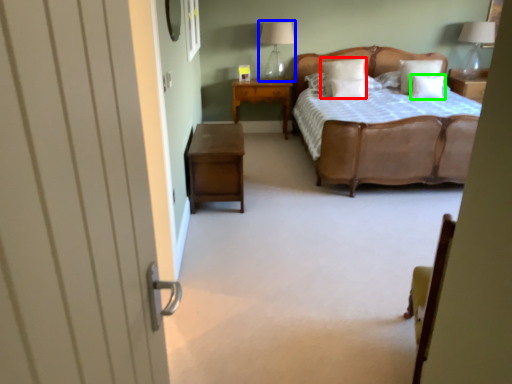
Question: Considering the real-world distances, which object is closest to pillow (highlighted by a red box)? table lamp (highlighted by a blue box) or pillow (highlighted by a green box).

Choices:
 (A) table lamp
 (B) pillow

Answer: (B)